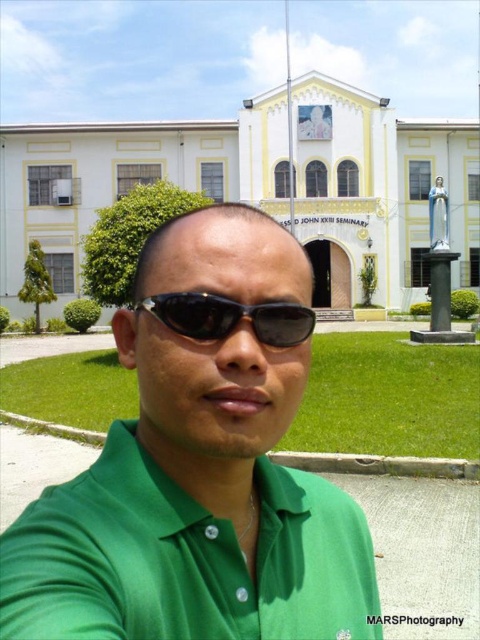
You are a photographer trying to capture the person in the image. Since both the green satin dress shirt at center and the black reflective sunglasses at center are at the center, which one is closer to the camera?

The green satin dress shirt at center is positioned under the black reflective sunglasses at center, meaning the sunglasses are closer to the camera.

You are standing at point (149, 307) and want to walk to point (98, 513). Which direction should you move?

You should move forward because point (98, 513) is in front of point (149, 307).